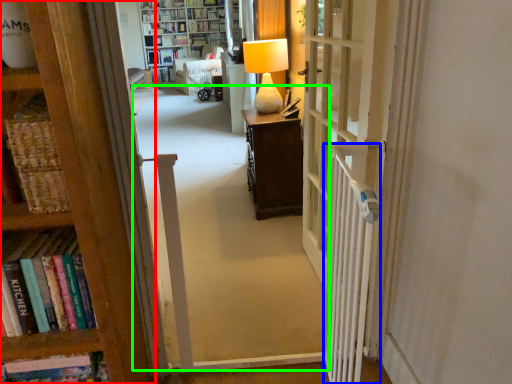
Question: Which is farther away from bookcase (highlighted by a red box)? radiator (highlighted by a blue box) or corridor (highlighted by a green box)?

Choices:
 (A) radiator
 (B) corridor

Answer: (B)